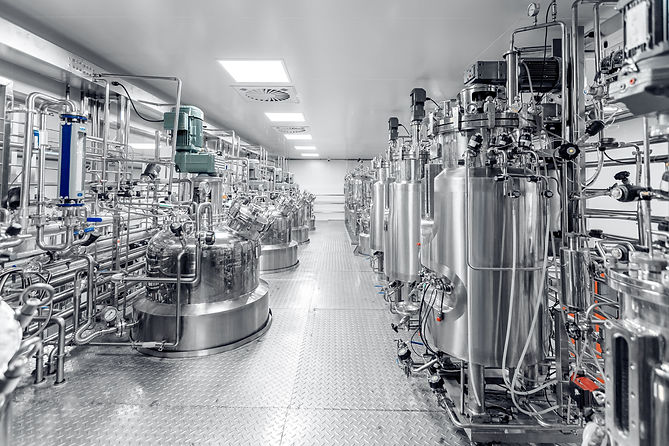
Where is `right side knobs`? The image size is (669, 446). right side knobs is located at coordinates (617, 187), (619, 248), (565, 151).